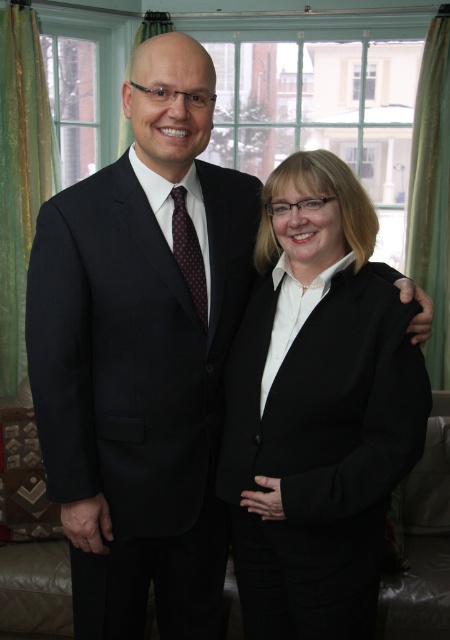
Question: Among these points, which one is farthest from the camera?

Choices:
 (A) 129,68
 (B) 4,132

Answer: (A)

Question: Can you confirm if green sheer curtain at left is wider than clear glass window at upper center?

Choices:
 (A) yes
 (B) no

Answer: (B)

Question: Which point is closer to the camera?

Choices:
 (A) (130, 60)
 (B) (54, 157)
 (C) (365, 93)
 (D) (446, 26)

Answer: (D)

Question: Is dark maroon dotted tie at center in front of clear glass window at upper center?

Choices:
 (A) no
 (B) yes

Answer: (B)

Question: Which point is closer to the camera?

Choices:
 (A) green fabric curtain at upper left
 (B) clear glass window at upper center
 (C) green fabric curtain at right

Answer: (C)

Question: Does dark maroon dotted tie at center appear over clear glass window at upper center?

Choices:
 (A) yes
 (B) no

Answer: (B)